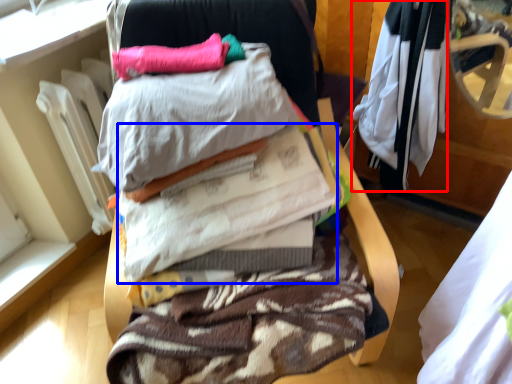
Question: Which object is further to the camera taking this photo, clothing (highlighted by a red box) or clothing (highlighted by a blue box)?

Choices:
 (A) clothing
 (B) clothing

Answer: (A)